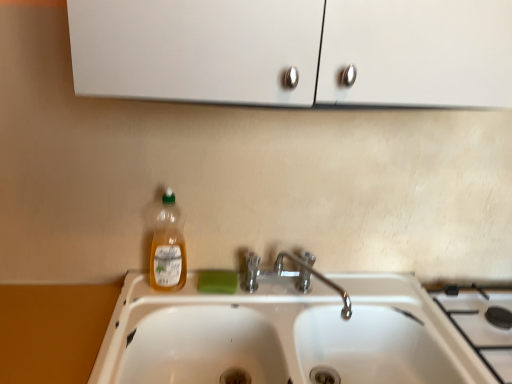
What are the coordinates of `vacant space to the left of green matte soap at sink` in the screenshot? It's located at (161, 296).